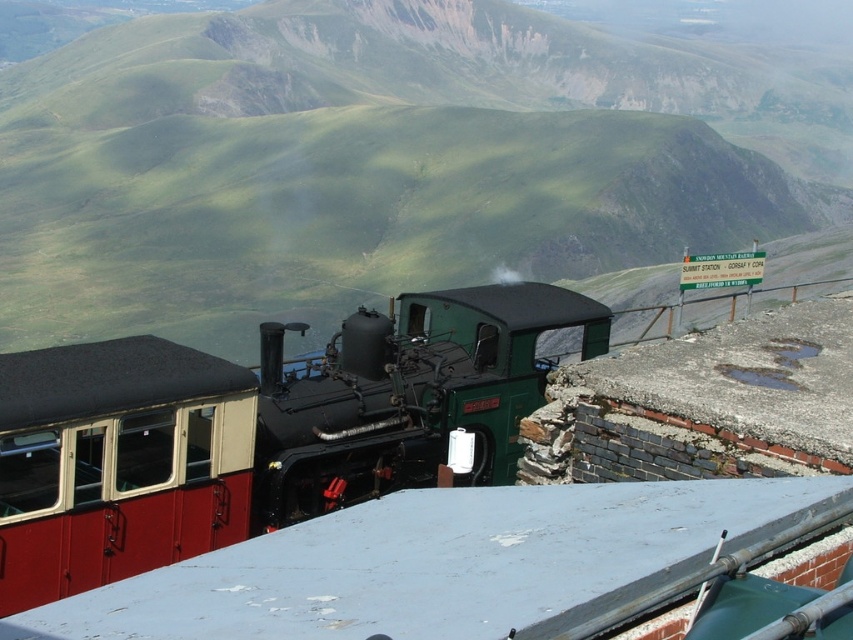
Does red polished wood train car at lower left have a lesser width compared to green polished metal steam engine at center?

In fact, red polished wood train car at lower left might be wider than green polished metal steam engine at center.

Based on the photo, is red polished wood train car at lower left wider than green polished metal steam engine at center?

Correct, the width of red polished wood train car at lower left exceeds that of green polished metal steam engine at center.

This screenshot has height=640, width=853. I want to click on red polished wood train car at lower left, so click(x=117, y=461).

Which is above, red polished wood train at center or green polished metal steam engine at center?

Positioned higher is green polished metal steam engine at center.

Who is more distant from viewer, (45,566) or (258,429)?

Positioned behind is point (258,429).

Is point (409, 477) closer to camera compared to point (315, 369)?

Yes, point (409, 477) is closer to viewer.

At what (x,y) coordinates should I click in order to perform the action: click on red polished wood train at center. Please return your answer as a coordinate pair (x, y). This screenshot has width=853, height=640. Looking at the image, I should click on (257, 429).

Who is positioned more to the left, red polished wood train at center or red polished wood train car at lower left?

red polished wood train at center

Which is below, red polished wood train at center or red polished wood train car at lower left?

Positioned lower is red polished wood train car at lower left.

Is point (515, 296) more distant than point (4, 516)?

That is True.

Identify the location of red polished wood train at center. (257, 429).